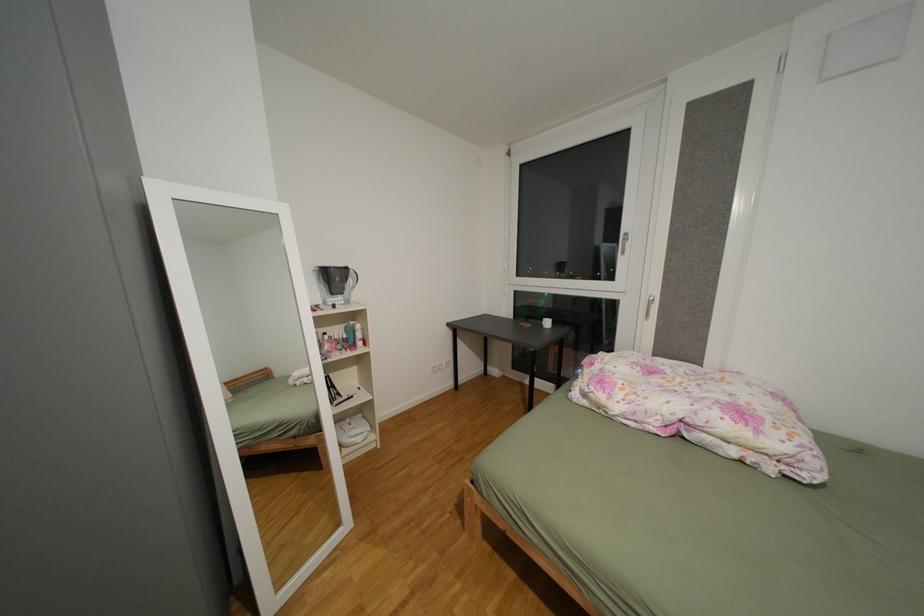
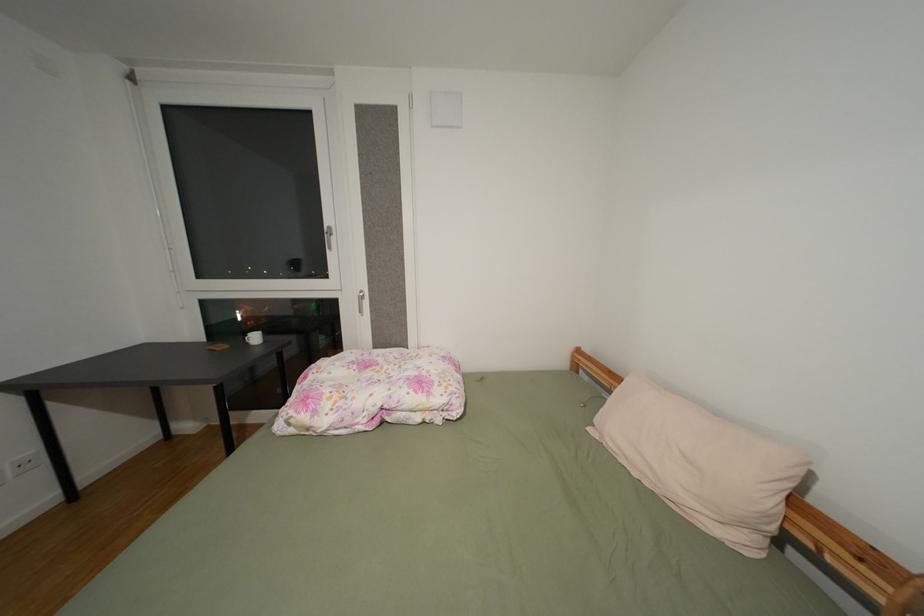
Question: The images are taken continuously from a first-person perspective. In which direction is your viewpoint rotating?

Choices:
 (A) Left
 (B) Right
 (C) Up
 (D) Down

Answer: (B)